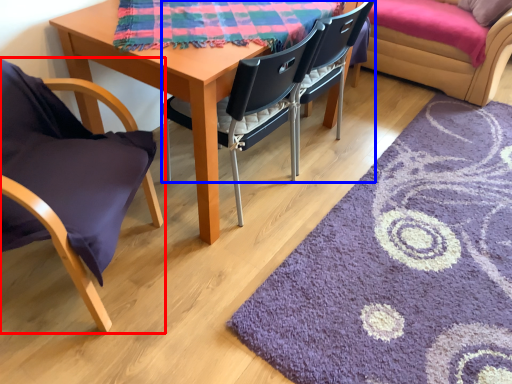
Question: Which point is closer to the camera, chair (highlighted by a red box) or chair (highlighted by a blue box)?

Choices:
 (A) chair
 (B) chair

Answer: (A)